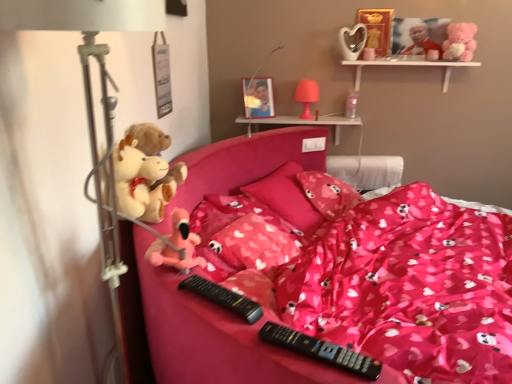
You are a GUI agent. You are given a task and a screenshot of the screen. Output one action in this format:
    pyautogui.click(x=<x>, y=<y>)
    Task: Click on the pink plush bear at upper right, the third toy positioned from the front
    The height and width of the screenshot is (384, 512).
    Given the screenshot: What is the action you would take?
    pyautogui.click(x=459, y=42)

I want to click on transparent plastic cup at upper center, which is the 5th toy from front to back, so click(x=351, y=104).

Measure the distance between white plastic table lamp at left, placed as the 1th table lamp when sorted from front to back, and camera.

white plastic table lamp at left, placed as the 1th table lamp when sorted from front to back, and camera are 87.90 centimeters apart.

In order to face white plastic table lamp at left, marked as the third table lamp in a back-to-front arrangement, should I rotate leftwards or rightwards?

Rotate left and turn 17.408 degrees.

The height and width of the screenshot is (384, 512). Find the location of `black plastic remote at lower center, acting as the first remote starting from the right`. black plastic remote at lower center, acting as the first remote starting from the right is located at coordinates (320, 350).

I want to click on smooth plastic teddy bear at upper right, the 4th toy viewed from the front, so click(421, 42).

Identify the location of toy that is the 1st one when counting rightward from the pink fabric pillow at center, the 3th pillow positioned from the front. This screenshot has width=512, height=384. 351,104.

From a real-world perspective, between pink fabric pillow at center, the 3th pillow positioned from the front, and transparent plastic cup at upper center, which is the 5th toy from front to back, who is vertically higher?

transparent plastic cup at upper center, which is the 5th toy from front to back.

From the image's perspective, between pink fabric pillow at center, the 3th pillow positioned from the front, and transparent plastic cup at upper center, arranged as the 3th toy when viewed from the right, which one is located above?

transparent plastic cup at upper center, arranged as the 3th toy when viewed from the right.

Which is farther from the camera, (x=359, y=196) or (x=352, y=96)?

The point (x=352, y=96) is more distant.

Who is shorter, pink plush toy at center, which ranks as the fifth toy in top-to-bottom order, or smooth plastic teddy bear at upper right, the second toy in the right-to-left sequence?

pink plush toy at center, which ranks as the fifth toy in top-to-bottom order, is shorter.

In the image, is pink plush toy at center, acting as the first toy starting from the bottom, positioned in front of or behind smooth plastic teddy bear at upper right, marked as the fourth toy in a left-to-right arrangement?

In the image, pink plush toy at center, acting as the first toy starting from the bottom, appears in front of smooth plastic teddy bear at upper right, marked as the fourth toy in a left-to-right arrangement.

Between pink plush toy at center, the 5th toy when ordered from back to front, and smooth plastic teddy bear at upper right, the 4th toy viewed from the front, which one has smaller width?

With smaller width is smooth plastic teddy bear at upper right, the 4th toy viewed from the front.

Is pink satin blanket at center touching pink plastic table lamp at upper center, the third table lamp positioned from the front?

No, pink satin blanket at center is not touching pink plastic table lamp at upper center, the third table lamp positioned from the front.

Considering the positions of point (498, 327) and point (298, 85), is point (498, 327) closer or farther from the camera than point (298, 85)?

Point (498, 327).

Looking at this image, could you tell me if pink satin blanket at center is turned towards pink plastic table lamp at upper center, arranged as the 1th table lamp when viewed from the back?

No, pink satin blanket at center is not aimed at pink plastic table lamp at upper center, arranged as the 1th table lamp when viewed from the back.

From the image's perspective, relative to pink plastic table lamp at upper center, the 1th table lamp positioned from the right, is pink satin blanket at center above or below?

Based on their image positions, pink satin blanket at center is located beneath pink plastic table lamp at upper center, the 1th table lamp positioned from the right.

Looking at this image, considering the relative sizes of smooth plastic teddy bear at upper right, the 2th toy viewed from the back, and pink plastic shelf at upper center, which is the 1th shelf from left to right, in the image provided, is smooth plastic teddy bear at upper right, the 2th toy viewed from the back, bigger than pink plastic shelf at upper center, which is the 1th shelf from left to right,?

No.

Is smooth plastic teddy bear at upper right, the second toy in the right-to-left sequence, turned away from pink plastic shelf at upper center, the 2th shelf viewed from the top?

No, smooth plastic teddy bear at upper right, the second toy in the right-to-left sequence,'s orientation is not away from pink plastic shelf at upper center, the 2th shelf viewed from the top.

Does smooth plastic teddy bear at upper right, which is the 1th toy in top-to-bottom order, contain pink plastic shelf at upper center, which is the 1th shelf from left to right?

No, pink plastic shelf at upper center, which is the 1th shelf from left to right, is not inside smooth plastic teddy bear at upper right, which is the 1th toy in top-to-bottom order.

From the image's perspective, is smooth plastic teddy bear at upper right, the 4th toy viewed from the front, located beneath pink plastic shelf at upper center, which is counted as the 2th shelf, starting from the right?

No, from the image's perspective, smooth plastic teddy bear at upper right, the 4th toy viewed from the front, is not beneath pink plastic shelf at upper center, which is counted as the 2th shelf, starting from the right.

Would you say pink fabric pillow at center, which is counted as the 1th pillow, starting from the front, contains pink fabric pillow at center, the second pillow when ordered from back to front?

Definitely not — pink fabric pillow at center, the second pillow when ordered from back to front, is not inside pink fabric pillow at center, which is counted as the 1th pillow, starting from the front.

Consider the image. From a real-world perspective, who is located lower, pink fabric pillow at center, the 3th pillow when ordered from back to front, or pink fabric pillow at center, marked as the 2th pillow in a front-to-back arrangement?

pink fabric pillow at center, marked as the 2th pillow in a front-to-back arrangement, is physically lower.

From the image's perspective, is pink fabric pillow at center, the 3th pillow when ordered from back to front, on top of pink fabric pillow at center, marked as the 2th pillow in a front-to-back arrangement?

No.

Is pink fabric pillow at center, the 3th pillow when ordered from back to front, taller than pink fabric pillow at center, marked as the 2th pillow in a front-to-back arrangement?

No.

Which of these two, fluffy plush toys at left, positioned as the fifth toy in right-to-left order, or white wooden shelf at upper right, which appears as the second shelf when ordered from the bottom, stands shorter?

With less height is white wooden shelf at upper right, which appears as the second shelf when ordered from the bottom.

How far apart are fluffy plush toys at left, the fourth toy from the top, and white wooden shelf at upper right, the 2th shelf positioned from the left?

fluffy plush toys at left, the fourth toy from the top, is 5.60 feet away from white wooden shelf at upper right, the 2th shelf positioned from the left.

Based on the photo, is fluffy plush toys at left, the second toy from the bottom, turned away from white wooden shelf at upper right, the first shelf positioned from the right?

No, fluffy plush toys at left, the second toy from the bottom, is not facing the opposite direction of white wooden shelf at upper right, the first shelf positioned from the right.

Consider the image. Are fluffy plush toys at left, positioned as the fifth toy in right-to-left order, and white wooden shelf at upper right, which appears as the second shelf when ordered from the bottom, far apart?

Yes, fluffy plush toys at left, positioned as the fifth toy in right-to-left order, and white wooden shelf at upper right, which appears as the second shelf when ordered from the bottom, are quite far apart.

Is pink fabric pillow at center, marked as the 2th pillow in a front-to-back arrangement, aimed at pink plastic table lamp at upper center, the second table lamp from the front?

No, pink fabric pillow at center, marked as the 2th pillow in a front-to-back arrangement, is not aimed at pink plastic table lamp at upper center, the second table lamp from the front.

Is pink fabric pillow at center, the second pillow when ordered from back to front, thinner than pink plastic table lamp at upper center, which ranks as the 2th table lamp in back-to-front order?

No, pink fabric pillow at center, the second pillow when ordered from back to front, is not thinner than pink plastic table lamp at upper center, which ranks as the 2th table lamp in back-to-front order.

From the picture: Considering the positions of objects pink fabric pillow at center, the second pillow when ordered from back to front, and pink plastic table lamp at upper center, the second table lamp from the front, in the image provided, who is behind, pink fabric pillow at center, the second pillow when ordered from back to front, or pink plastic table lamp at upper center, the second table lamp from the front,?

pink plastic table lamp at upper center, the second table lamp from the front, is more distant.

From the transparent plastic cup at upper center, acting as the third toy starting from the bottom, count the 1st pillow to the left and point to it. Please provide its 2D coordinates.

[(328, 194)]

You are a GUI agent. You are given a task and a screenshot of the screen. Output one action in this format:
    pyautogui.click(x=<x>, y=<y>)
    Task: Click on the 2nd toy to the right of the pink plush toy at center, positioned as the 1th toy in front-to-back order, starting your count from the anchor
    This screenshot has width=512, height=384.
    Given the screenshot: What is the action you would take?
    pyautogui.click(x=421, y=42)

Estimate the real-world distances between objects in this image. Which object is further from pink satin blanket at center, pink plastic table lamp at upper center, which ranks as the 2th table lamp in back-to-front order, or pink fabric pillow at center, the second pillow when ordered from back to front?

pink plastic table lamp at upper center, which ranks as the 2th table lamp in back-to-front order.

Based on their spatial positions, is pink fabric pillow at center, which is counted as the 1th pillow, starting from the front, or pink fabric pillow at center, marked as the 2th pillow in a front-to-back arrangement, closer to white plastic table lamp at left, marked as the third table lamp in a right-to-left arrangement?

Based on the image, pink fabric pillow at center, which is counted as the 1th pillow, starting from the front, appears to be nearer to white plastic table lamp at left, marked as the third table lamp in a right-to-left arrangement.

Looking at the image, which one is located further to black plastic remote at center, positioned as the 2th remote in front-to-back order, pink plastic shelf at upper center, the 2th shelf viewed from the top, or pink plastic table lamp at upper center, which is the 3th table lamp from left to right?

pink plastic table lamp at upper center, which is the 3th table lamp from left to right, is further to black plastic remote at center, positioned as the 2th remote in front-to-back order.

From the image, which object appears to be nearer to pink plastic table lamp at upper center, the 2th table lamp when ordered from left to right, pink fabric pillow at center, which is counted as the 1th pillow, starting from the front, or pink plastic shelf at upper center, which is counted as the 2th shelf, starting from the right?

The object closer to pink plastic table lamp at upper center, the 2th table lamp when ordered from left to right, is pink plastic shelf at upper center, which is counted as the 2th shelf, starting from the right.

Estimate the real-world distances between objects in this image. Which object is further from pink satin blanket at center, black plastic remote at lower center, acting as the first remote starting from the right, or black plastic remote at center, which ranks as the first remote in back-to-front order?

Based on the image, black plastic remote at lower center, acting as the first remote starting from the right, appears to be further to pink satin blanket at center.

When comparing their distances from pink fabric pillow at center, which is counted as the 1th pillow, starting from the front, does black plastic remote at center, positioned as the 2th remote in front-to-back order, or pink plastic shelf at upper center, the 2th shelf viewed from the top, seem further?

pink plastic shelf at upper center, the 2th shelf viewed from the top.

From the image, which object appears to be nearer to metallic photo frame at upper center, pink fabric pillow at center, which is counted as the 1th pillow, starting from the front, or pink plastic shelf at upper center, the first shelf ordered from the bottom?

pink plastic shelf at upper center, the first shelf ordered from the bottom, is closer to metallic photo frame at upper center.

Based on their spatial positions, is metallic photo frame at upper center or transparent plastic cup at upper center, arranged as the 3th toy when viewed from the right, further from pink fabric pillow at center, the 3th pillow when ordered from back to front?

transparent plastic cup at upper center, arranged as the 3th toy when viewed from the right, is further to pink fabric pillow at center, the 3th pillow when ordered from back to front.

Where is `shelf positioned between black plastic remote at lower center, acting as the first remote starting from the right, and metallic photo frame at upper center from near to far`? The image size is (512, 384). shelf positioned between black plastic remote at lower center, acting as the first remote starting from the right, and metallic photo frame at upper center from near to far is located at coordinates (409, 65).

Identify the location of shelf between white plastic table lamp at left, marked as the third table lamp in a right-to-left arrangement, and metallic photo frame at upper center from front to back. Image resolution: width=512 pixels, height=384 pixels. (409, 65).

You are a GUI agent. You are given a task and a screenshot of the screen. Output one action in this format:
    pyautogui.click(x=<x>, y=<y>)
    Task: Click on the picture frame located between black plastic remote at center, positioned as the 2th remote in front-to-back order, and pink plastic shelf at upper center, which is counted as the 2th shelf, starting from the right, in the depth direction
    The width and height of the screenshot is (512, 384).
    Given the screenshot: What is the action you would take?
    pyautogui.click(x=258, y=97)

At what (x,y) coordinates should I click in order to perform the action: click on pillow between transparent plastic cup at upper center, which is the third toy from left to right, and pink fabric pillow at center, marked as the 2th pillow in a front-to-back arrangement, vertically. Please return your answer as a coordinate pair (x, y). Looking at the image, I should click on 328,194.